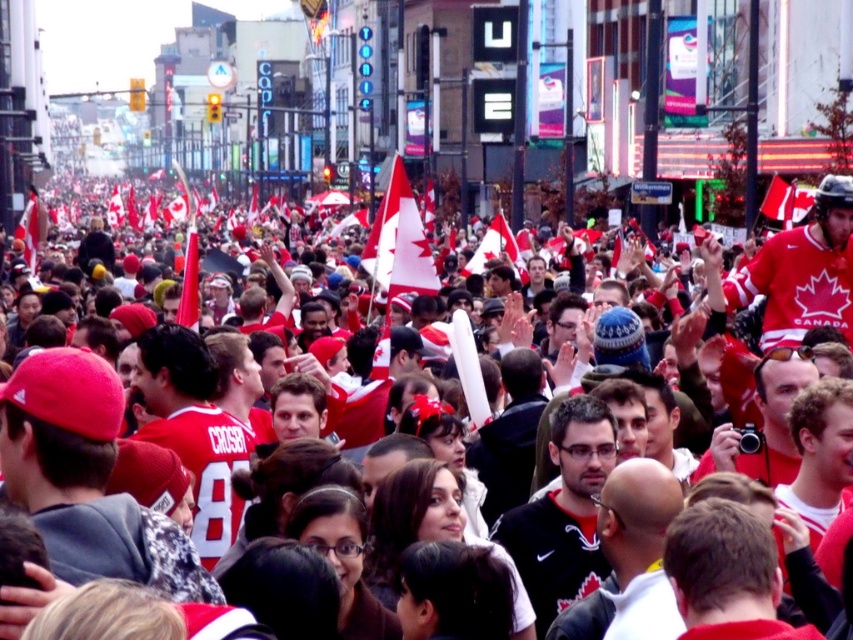
Question: Where is red fabric crowd at center located in relation to red fabric flag at upper right in the image?

Choices:
 (A) left
 (B) right

Answer: (A)

Question: Is red fabric crowd at center positioned behind red fabric flag at upper right?

Choices:
 (A) yes
 (B) no

Answer: (B)

Question: Is red fabric crowd at center bigger than red fabric flag at upper right?

Choices:
 (A) no
 (B) yes

Answer: (B)

Question: Which point is farther to the camera?

Choices:
 (A) (770, 179)
 (B) (622, 524)

Answer: (A)